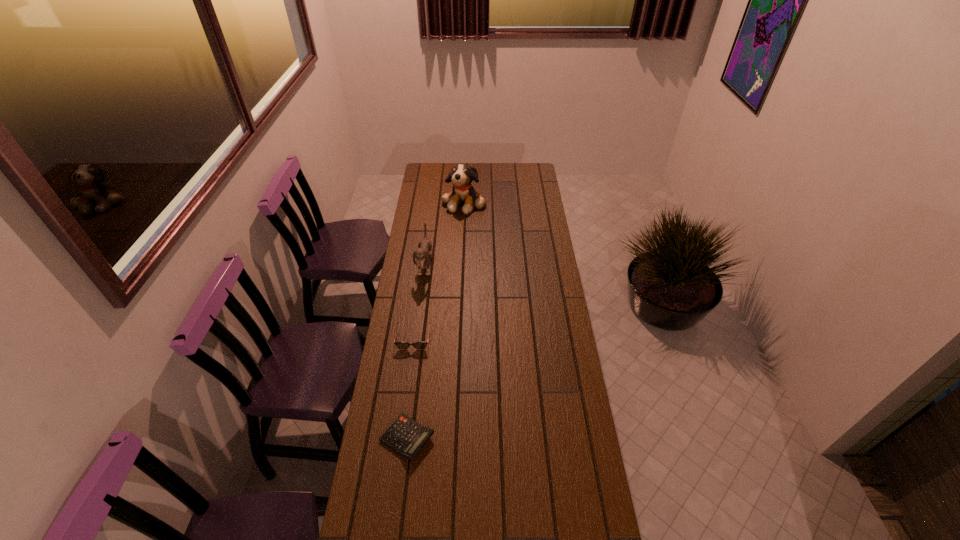
This screenshot has height=540, width=960. Identify the location of vacant area situated 0.090m at the front view of the second shortest object. (409, 369).

Image resolution: width=960 pixels, height=540 pixels. Find the location of `free space located 0.320m on the back of the shortest object`. free space located 0.320m on the back of the shortest object is located at coordinates (420, 341).

You are a GUI agent. You are given a task and a screenshot of the screen. Output one action in this format:
    pyautogui.click(x=<x>, y=<y>)
    Task: Click on the spectacles at the left edge
    This screenshot has width=960, height=540.
    Given the screenshot: What is the action you would take?
    pyautogui.click(x=400, y=345)

The image size is (960, 540). I want to click on calculator located in the left edge section of the desktop, so click(x=406, y=437).

I want to click on free region at the far edge of the desktop, so [480, 173].

Locate an element on the screen. The height and width of the screenshot is (540, 960). free space at the left edge of the desktop is located at coordinates (391, 408).

Where is `free region at the right edge of the desktop`? Image resolution: width=960 pixels, height=540 pixels. free region at the right edge of the desktop is located at coordinates (522, 237).

The width and height of the screenshot is (960, 540). Identify the location of vacant space at the far left corner. (427, 177).

In the image, there is a desktop. Where is `free region at the far right corner`? free region at the far right corner is located at coordinates (522, 168).

Where is `vacant space that's between the nearest object and the third shortest object`? This screenshot has width=960, height=540. vacant space that's between the nearest object and the third shortest object is located at coordinates (416, 352).